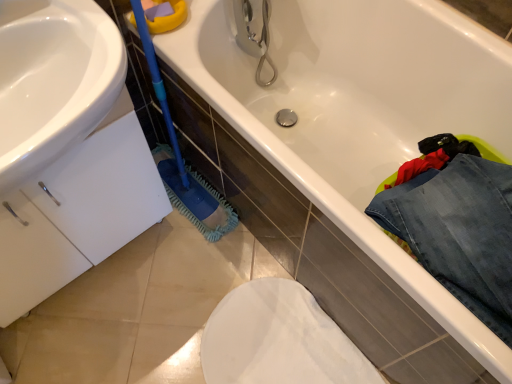
What do you see at coordinates (183, 161) in the screenshot? This screenshot has width=512, height=384. I see `blue microfiber brush at lower left` at bounding box center [183, 161].

At what (x,y) coordinates should I click in order to perform the action: click on blue microfiber brush at lower left. Please return your answer as a coordinate pair (x, y). The image size is (512, 384). Looking at the image, I should click on (183, 161).

At what (x,y) coordinates should I click in order to perform the action: click on denim jeans at lower right. Please return your answer as a coordinate pair (x, y). This screenshot has width=512, height=384. Looking at the image, I should click on (459, 232).

The height and width of the screenshot is (384, 512). What do you see at coordinates (459, 232) in the screenshot? I see `denim jeans at lower right` at bounding box center [459, 232].

Where is `blue microfiber brush at lower left`? Image resolution: width=512 pixels, height=384 pixels. blue microfiber brush at lower left is located at coordinates (183, 161).

Is denim jeans at lower right to the left of blue microfiber brush at lower left from the viewer's perspective?

No, denim jeans at lower right is not to the left of blue microfiber brush at lower left.

Is the position of denim jeans at lower right more distant than that of blue microfiber brush at lower left?

Yes, it is.

Is point (452, 259) more distant than point (203, 196)?

That is False.

From the image's perspective, does denim jeans at lower right appear lower than blue microfiber brush at lower left?

Yes, from the image's perspective, denim jeans at lower right is beneath blue microfiber brush at lower left.

From a real-world perspective, is denim jeans at lower right located higher than blue microfiber brush at lower left?

Yes, from a real-world perspective, denim jeans at lower right is above blue microfiber brush at lower left.

Does denim jeans at lower right have a greater width compared to blue microfiber brush at lower left?

Correct, the width of denim jeans at lower right exceeds that of blue microfiber brush at lower left.

Is denim jeans at lower right taller than blue microfiber brush at lower left?

Incorrect, the height of denim jeans at lower right is not larger of that of blue microfiber brush at lower left.

Looking at the image, does denim jeans at lower right seem bigger or smaller compared to blue microfiber brush at lower left?

Clearly, denim jeans at lower right is smaller in size than blue microfiber brush at lower left.

Is denim jeans at lower right positioned beyond the bounds of blue microfiber brush at lower left?

denim jeans at lower right lies outside blue microfiber brush at lower left's area.

Is denim jeans at lower right not close to blue microfiber brush at lower left?

No, denim jeans at lower right is not far from blue microfiber brush at lower left.

Could you tell me if denim jeans at lower right is turned towards blue microfiber brush at lower left?

No, denim jeans at lower right is not turned towards blue microfiber brush at lower left.

Measure the distance between denim jeans at lower right and blue microfiber brush at lower left.

denim jeans at lower right and blue microfiber brush at lower left are 28.89 inches apart from each other.

I want to click on brush in front of the denim jeans at lower right, so click(183, 161).

Can you confirm if blue microfiber brush at lower left is positioned to the right of denim jeans at lower right?

No.

Based on the photo, does blue microfiber brush at lower left lie behind denim jeans at lower right?

No, blue microfiber brush at lower left is closer to the camera.

Considering the positions of points (149, 67) and (399, 235), is point (149, 67) farther from camera compared to point (399, 235)?

That is True.

From the image's perspective, is blue microfiber brush at lower left positioned above or below denim jeans at lower right?

blue microfiber brush at lower left is above denim jeans at lower right.

From a real-world perspective, is blue microfiber brush at lower left physically located above or below denim jeans at lower right?

blue microfiber brush at lower left is situated lower than denim jeans at lower right in the real world.

Considering the sizes of blue microfiber brush at lower left and denim jeans at lower right in the image, is blue microfiber brush at lower left wider or thinner than denim jeans at lower right?

In the image, blue microfiber brush at lower left appears to be more narrow than denim jeans at lower right.

Is blue microfiber brush at lower left taller or shorter than denim jeans at lower right?

blue microfiber brush at lower left is taller than denim jeans at lower right.

From the picture: Considering the sizes of objects blue microfiber brush at lower left and denim jeans at lower right in the image provided, who is bigger, blue microfiber brush at lower left or denim jeans at lower right?

blue microfiber brush at lower left is bigger.

Choose the correct answer: Is blue microfiber brush at lower left inside denim jeans at lower right or outside it?

blue microfiber brush at lower left is spatially situated outside denim jeans at lower right.

Is blue microfiber brush at lower left not close to denim jeans at lower right?

No.

Is blue microfiber brush at lower left positioned with its back to denim jeans at lower right?

blue microfiber brush at lower left does not have its back to denim jeans at lower right.

How many degrees apart are the facing directions of blue microfiber brush at lower left and denim jeans at lower right?

90 degrees separate the facing orientations of blue microfiber brush at lower left and denim jeans at lower right.

Identify the location of brush in front of the denim jeans at lower right. (183, 161).

The height and width of the screenshot is (384, 512). In the image, there is a denim jeans at lower right. Identify the location of brush above it (from the image's perspective). (183, 161).

I want to click on clothing on the right of blue microfiber brush at lower left, so click(x=459, y=232).